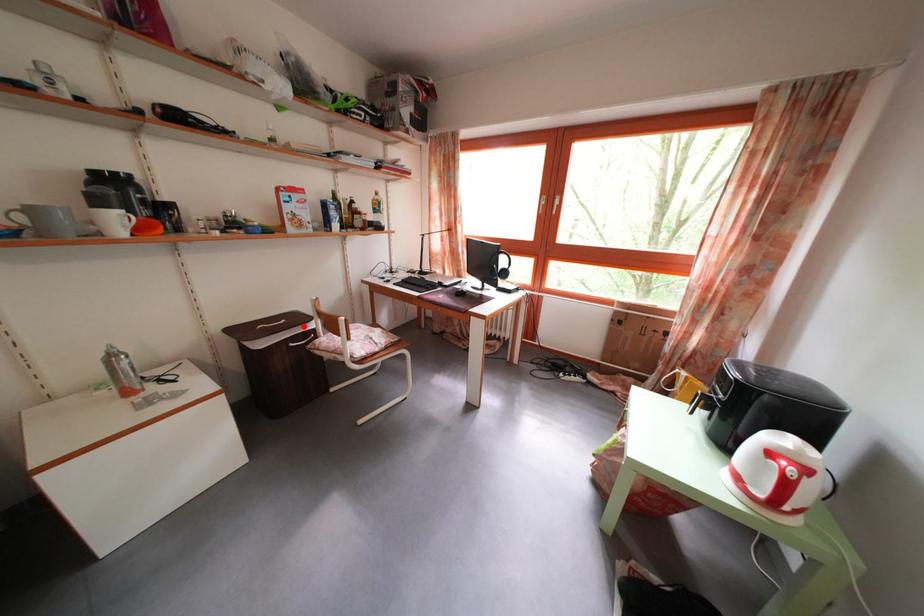
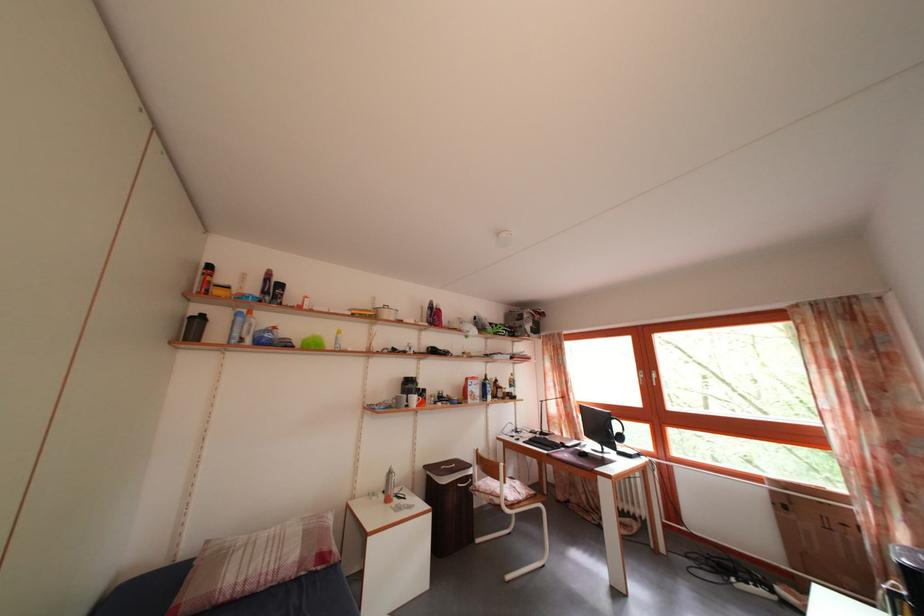
Question: A red point is marked in image1. In image2, is the corresponding 3D point closer to the camera or farther? Reply with the corresponding letter.

Choices:
 (A) The corresponding 3D point is closer.
 (B) The corresponding 3D point is farther.

Answer: (B)